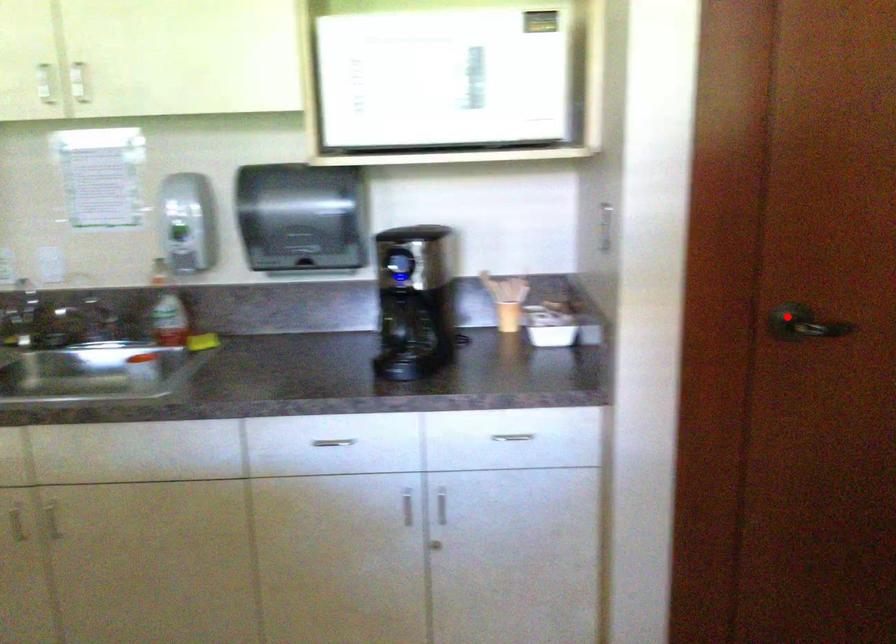
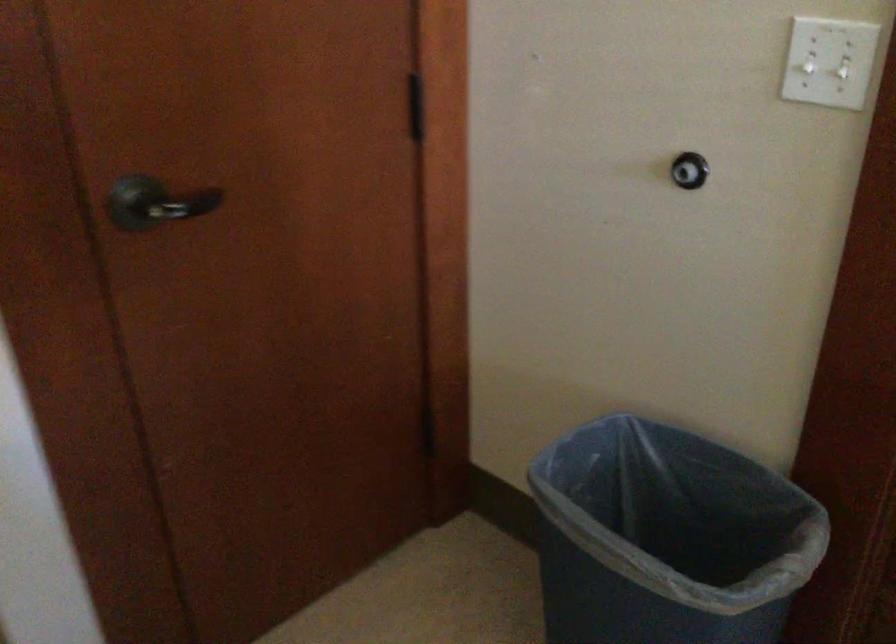
Question: I am providing you with two images of the same scene from different viewpoints. A red point is marked on the first image. At the location where the point appears in image 1, is it still visible in image 2?

Choices:
 (A) Yes
 (B) No

Answer: (A)